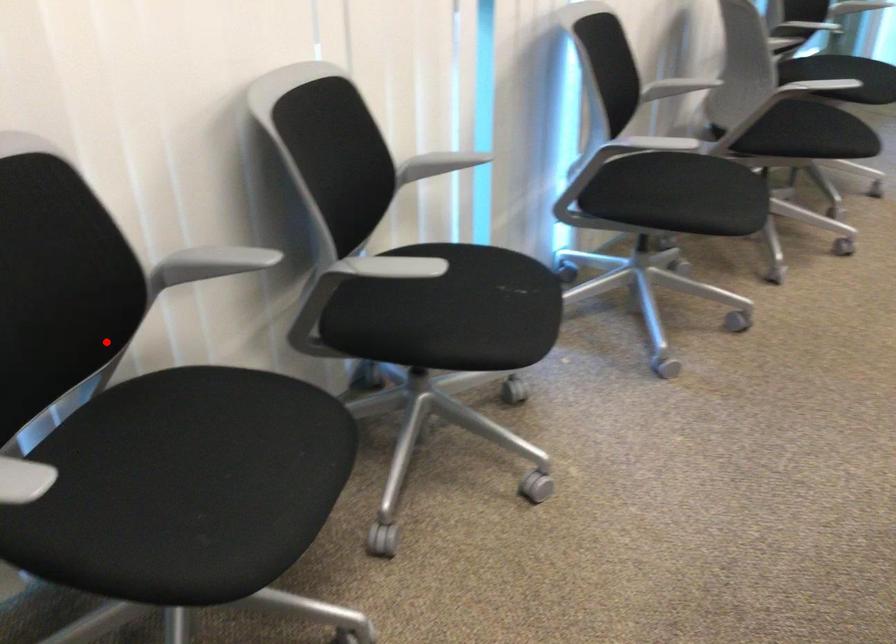
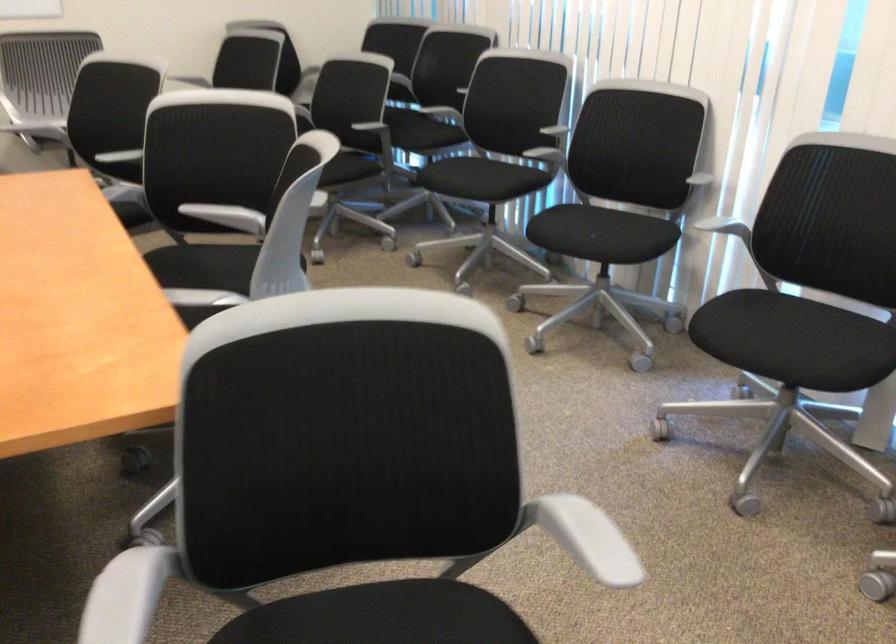
Question: I am providing you with two images of the same scene from different viewpoints. Image1 has a red point marked. In image2, the corresponding 3D location appears at what relative position? Reply with the corresponding letter.

Choices:
 (A) Closer
 (B) Farther

Answer: (B)